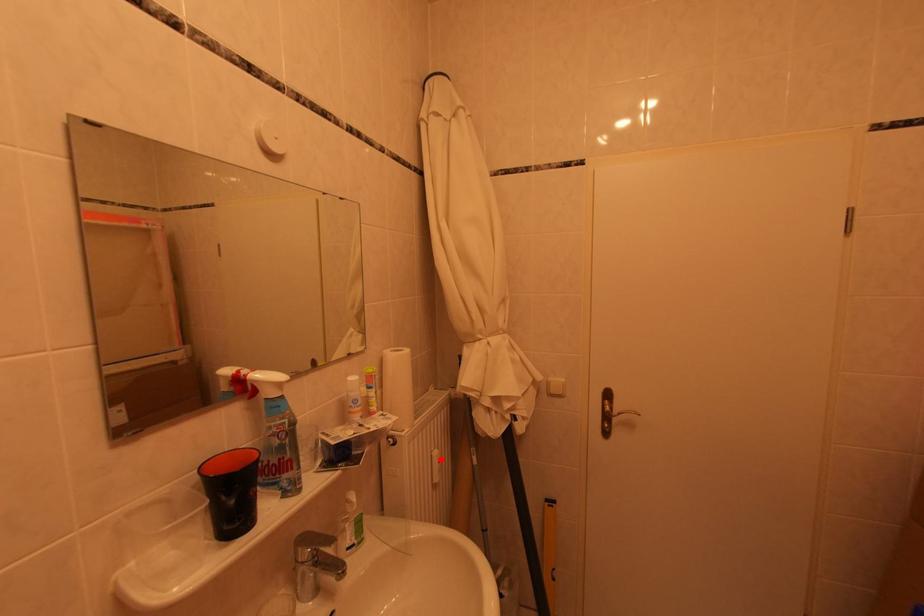
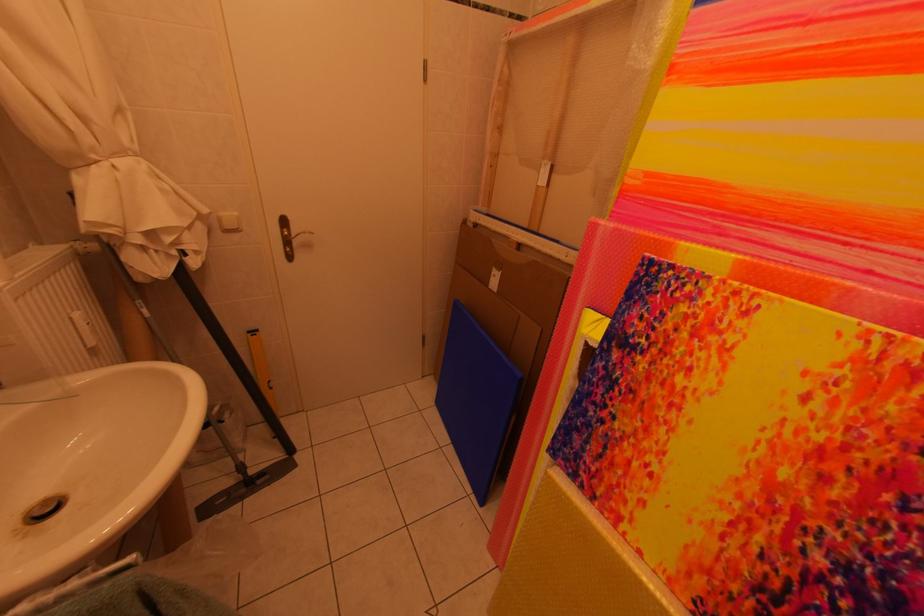
Question: I am providing you with two images of the same scene from different viewpoints. A red point is shown in image1. For the corresponding object point in image2, is it positioned nearer or farther from the camera?

Choices:
 (A) Nearer
 (B) Farther

Answer: (B)